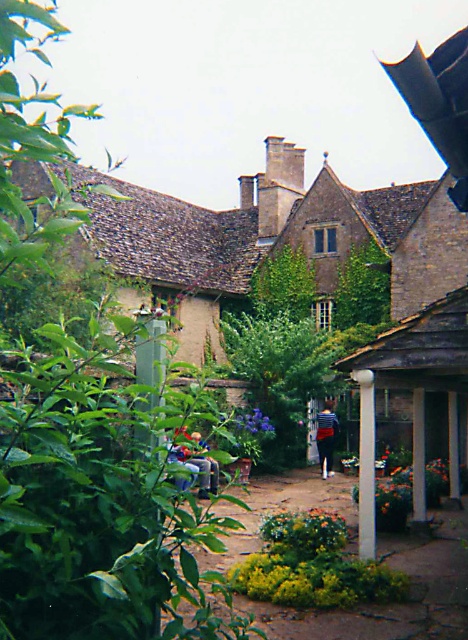
Question: Which of these objects is positioned closest to the white smooth pillar at center?

Choices:
 (A) striped shirt at center
 (B) denim jeans at center

Answer: (A)

Question: Does white painted wood at center have a lesser width compared to striped shirt at center?

Choices:
 (A) yes
 (B) no

Answer: (A)

Question: Which object is the farthest from the purple matte flower at center?

Choices:
 (A) white painted wood at center
 (B) striped shirt at center
 (C) white smooth pillar at center
 (D) denim jeans at center

Answer: (A)

Question: Is white painted wood at center to the left of striped shirt at center from the viewer's perspective?

Choices:
 (A) no
 (B) yes

Answer: (A)

Question: Estimate the real-world distances between objects in this image. Which object is farther from the purple matte flower at center?

Choices:
 (A) striped shirt at center
 (B) denim jeans at center
 (C) white painted wood at center

Answer: (C)

Question: In this image, where is white smooth pillar at center located relative to denim jeans at center?

Choices:
 (A) right
 (B) left

Answer: (A)